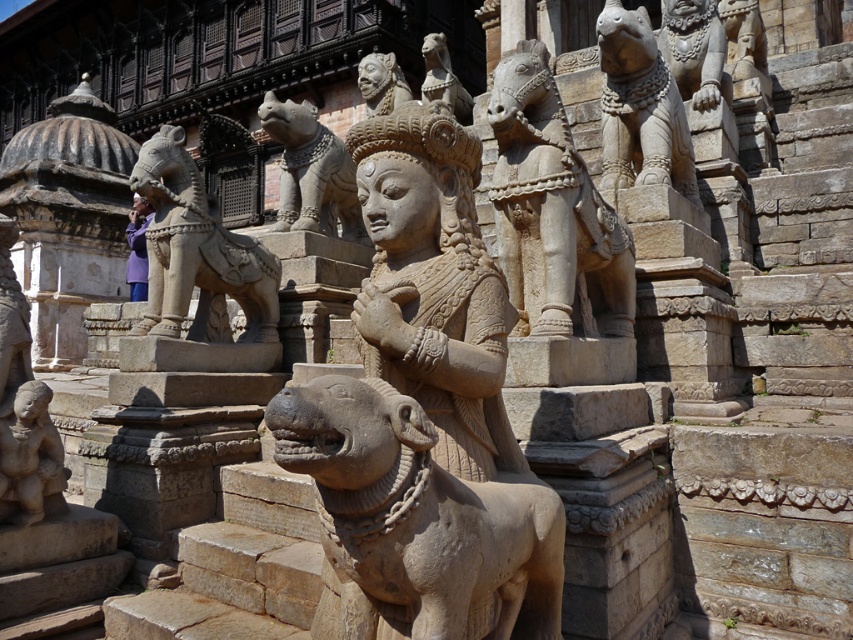
Question: Considering the relative positions of carved stone horse at upper center and stone lion at center in the image provided, where is carved stone horse at upper center located with respect to stone lion at center?

Choices:
 (A) below
 (B) above

Answer: (B)

Question: Estimate the real-world distances between objects in this image. Which object is closer to the stone lion at upper center?

Choices:
 (A) stone lion at upper right
 (B) smooth stone statue at center

Answer: (A)

Question: Estimate the real-world distances between objects in this image. Which object is farther from the polished stone mask at upper center?

Choices:
 (A) carved stone horse at upper center
 (B) smooth beige statue at lower left

Answer: (B)

Question: Where is carved stone horse at upper center located in relation to polished stone mask at upper center in the image?

Choices:
 (A) above
 (B) below

Answer: (B)

Question: Estimate the real-world distances between objects in this image. Which object is closer to the brown stone dog at center?

Choices:
 (A) stone lion at center
 (B) smooth stone statue at center

Answer: (B)

Question: Is carved stone horse at upper center to the left of stone lion at upper center from the viewer's perspective?

Choices:
 (A) no
 (B) yes

Answer: (A)